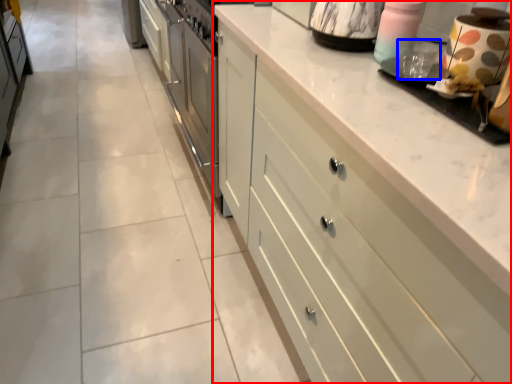
Question: Which of the following is the farthest to the observer, cabinetry (highlighted by a red box) or appliance (highlighted by a blue box)?

Choices:
 (A) cabinetry
 (B) appliance

Answer: (B)